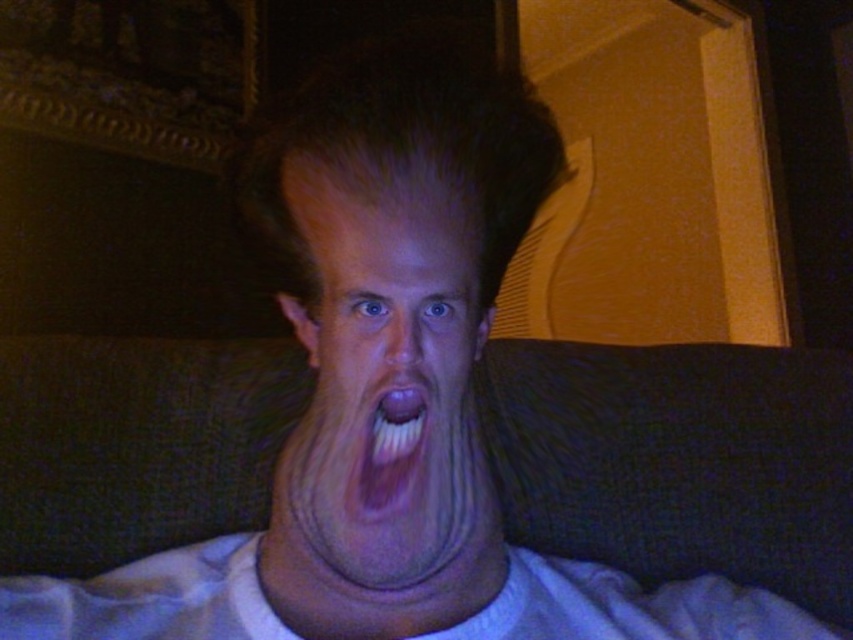
Measure the distance from pink glossy tongue at center to smooth flesh nose at center.

pink glossy tongue at center and smooth flesh nose at center are 1.36 inches apart from each other.

In the scene shown: Is pink glossy tongue at center shorter than smooth flesh nose at center?

No.

What do you see at coordinates (392, 449) in the screenshot? The height and width of the screenshot is (640, 853). I see `pink glossy tongue at center` at bounding box center [392, 449].

Locate an element on the screen. pink glossy tongue at center is located at coordinates (392, 449).

Who is positioned more to the left, smooth skin face at center or pink glossy tongue at center?

From the viewer's perspective, smooth skin face at center appears more on the left side.

Looking at this image, is smooth skin face at center in front of pink glossy tongue at center?

Yes, smooth skin face at center is in front of pink glossy tongue at center.

Who is more forward, (347, 420) or (415, 435)?

Point (347, 420) is in front.

The width and height of the screenshot is (853, 640). Find the location of `smooth skin face at center`. smooth skin face at center is located at coordinates (384, 387).

Who is more distant from viewer, (410,483) or (399,353)?

The point (410,483) is behind.

Is point (421, 513) positioned in front of point (387, 352)?

No, it is behind (387, 352).

What do you see at coordinates (384, 387) in the screenshot? I see `smooth skin face at center` at bounding box center [384, 387].

Locate an element on the screen. Image resolution: width=853 pixels, height=640 pixels. smooth skin face at center is located at coordinates (384, 387).